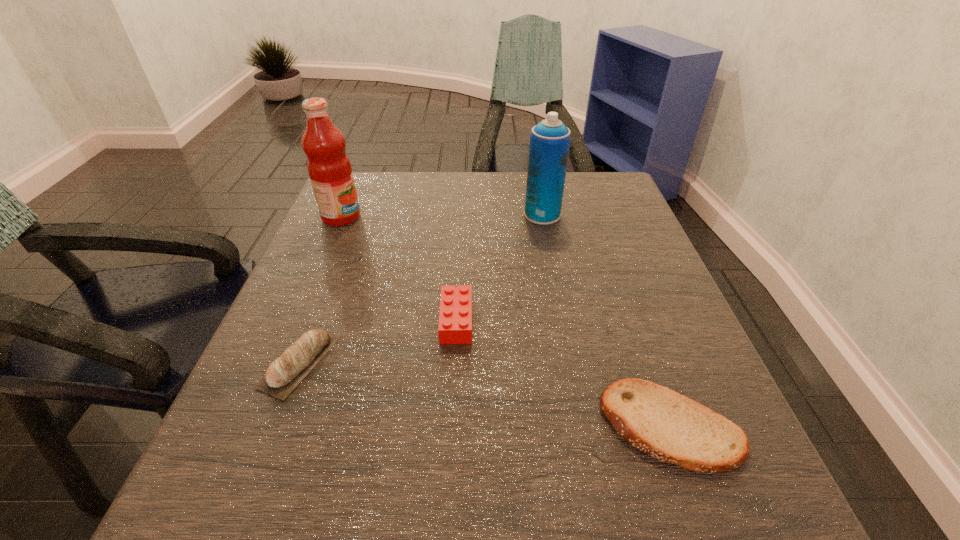
The height and width of the screenshot is (540, 960). In order to click on vacant area in the image that satisfies the following two spatial constraints: 1. on the front label of the fruit juice; 2. on the left side of the left pita bread in this screenshot , I will do `click(279, 361)`.

Locate an element on the screen. free space that satisfies the following two spatial constraints: 1. on the back side of the left pita bread; 2. on the left side of the aerosol can is located at coordinates (356, 214).

Where is `vacant area that satisfies the following two spatial constraints: 1. on the front label of the fruit juice; 2. on the right side of the third object from right to left`? The image size is (960, 540). vacant area that satisfies the following two spatial constraints: 1. on the front label of the fruit juice; 2. on the right side of the third object from right to left is located at coordinates (297, 320).

Where is `blank space that satisfies the following two spatial constraints: 1. on the front side of the aerosol can; 2. on the front label of the fruit juice`? This screenshot has height=540, width=960. blank space that satisfies the following two spatial constraints: 1. on the front side of the aerosol can; 2. on the front label of the fruit juice is located at coordinates (542, 217).

You are a GUI agent. You are given a task and a screenshot of the screen. Output one action in this format:
    pyautogui.click(x=<x>, y=<y>)
    Task: Click on the vacant point that satisfies the following two spatial constraints: 1. on the back side of the right pita bread; 2. on the front label of the fruit juice
    The width and height of the screenshot is (960, 540).
    Given the screenshot: What is the action you would take?
    pyautogui.click(x=596, y=217)

This screenshot has height=540, width=960. In order to click on vacant area in the image that satisfies the following two spatial constraints: 1. on the front label of the Lego; 2. on the left side of the fruit juice in this screenshot , I will do `click(297, 320)`.

Locate an element on the screen. vacant space that satisfies the following two spatial constraints: 1. on the back side of the Lego; 2. on the right side of the left pita bread is located at coordinates (316, 320).

Locate an element on the screen. The image size is (960, 540). vacant space that satisfies the following two spatial constraints: 1. on the front label of the fruit juice; 2. on the right side of the right pita bread is located at coordinates (252, 426).